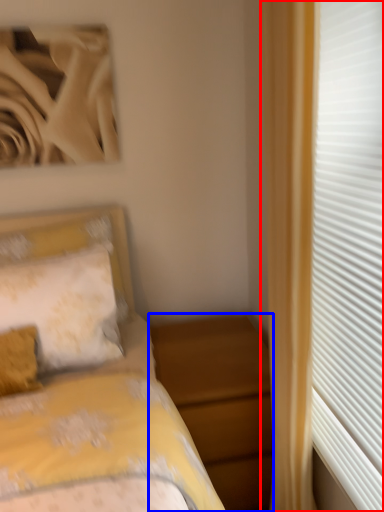
Question: Among these objects, which one is nearest to the camera, curtain (highlighted by a red box) or nightstand (highlighted by a blue box)?

Choices:
 (A) curtain
 (B) nightstand

Answer: (A)